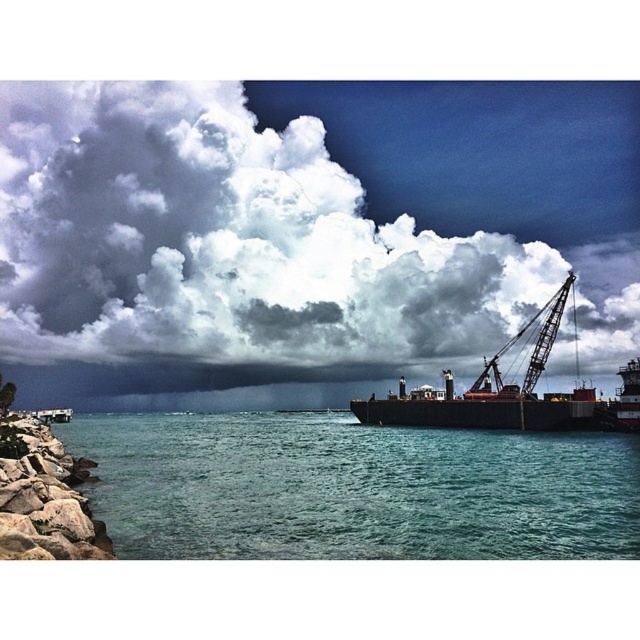
You are a photographer planning to capture the coastal scene. You want to ensure that both the white fluffy cloud at upper center and the teal glossy water at lower center are visible in your shot. Based on their sizes, which object should you prioritize framing first?

The white fluffy cloud at upper center is much taller than the teal glossy water at lower center, so you should prioritize framing the white fluffy cloud at upper center first to ensure it fits within the composition.

You are an observer standing on the cliff overlooking the coastal scene. You notice the white fluffy cloud at upper center and the dark brown metal ship at right. Which object is closer to your position?

The white fluffy cloud at upper center is closer to your position because it is further to the viewer than the dark brown metal ship at right.

You are a photographer planning to capture the dark brown metal ship at right and the white fluffy cloud at upper center in a single frame. Based on their sizes, which one will occupy more space in your photo?

The white fluffy cloud at upper center will occupy more space in the photo because it is larger in size than the dark brown metal ship at right.